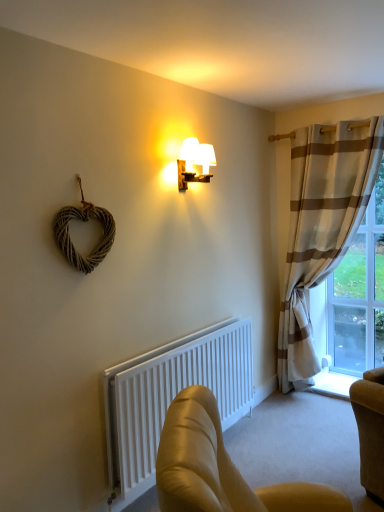
Question: From a real-world perspective, is clear glass window at right physically above leather armchair at lower center?

Choices:
 (A) yes
 (B) no

Answer: (A)

Question: Is there a large distance between clear glass window at right and leather armchair at lower center?

Choices:
 (A) yes
 (B) no

Answer: (A)

Question: Is clear glass window at right positioned before leather armchair at lower center?

Choices:
 (A) yes
 (B) no

Answer: (B)

Question: Does clear glass window at right have a lesser height compared to leather armchair at lower center?

Choices:
 (A) no
 (B) yes

Answer: (A)

Question: Does clear glass window at right have a greater height compared to leather armchair at lower center?

Choices:
 (A) no
 (B) yes

Answer: (B)

Question: Is woodenmaterial/texturelamp at upper center wider or thinner than leather armchair at lower center?

Choices:
 (A) wide
 (B) thin

Answer: (B)

Question: From the image's perspective, relative to leather armchair at lower center, is woodenmaterial/texturelamp at upper center above or below?

Choices:
 (A) above
 (B) below

Answer: (A)

Question: In terms of size, does woodenmaterial/texturelamp at upper center appear bigger or smaller than leather armchair at lower center?

Choices:
 (A) small
 (B) big

Answer: (A)

Question: From a real-world perspective, relative to leather armchair at lower center, is woodenmaterial/texturelamp at upper center vertically above or below?

Choices:
 (A) below
 (B) above

Answer: (B)

Question: From a real-world perspective, relative to clear glass window at right, is woodenmaterial/texturelamp at upper center vertically above or below?

Choices:
 (A) above
 (B) below

Answer: (A)

Question: Is woodenmaterial/texturelamp at upper center spatially inside clear glass window at right, or outside of it?

Choices:
 (A) outside
 (B) inside

Answer: (A)

Question: Considering the positions of woodenmaterial/texturelamp at upper center and clear glass window at right in the image, is woodenmaterial/texturelamp at upper center bigger or smaller than clear glass window at right?

Choices:
 (A) small
 (B) big

Answer: (A)

Question: Considering the positions of point (201, 152) and point (337, 365), is point (201, 152) closer or farther from the camera than point (337, 365)?

Choices:
 (A) closer
 (B) farther

Answer: (A)

Question: From a real-world perspective, is white matte radiator at lower center physically located above or below leather armchair at lower center?

Choices:
 (A) above
 (B) below

Answer: (A)

Question: From their relative heights in the image, would you say white matte radiator at lower center is taller or shorter than leather armchair at lower center?

Choices:
 (A) short
 (B) tall

Answer: (B)